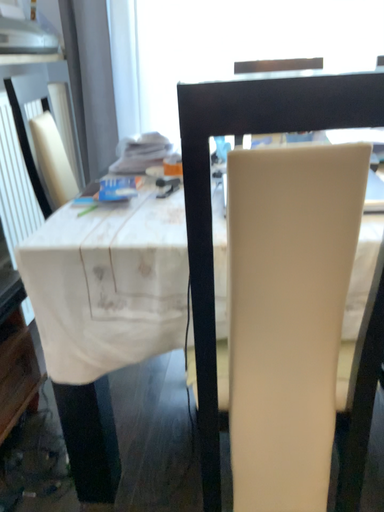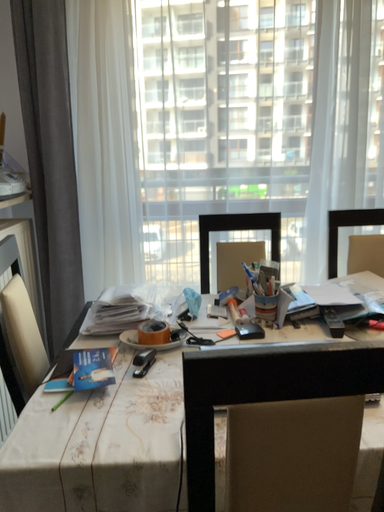
Question: Which way did the camera rotate in the video?

Choices:
 (A) rotated right
 (B) rotated left

Answer: (A)